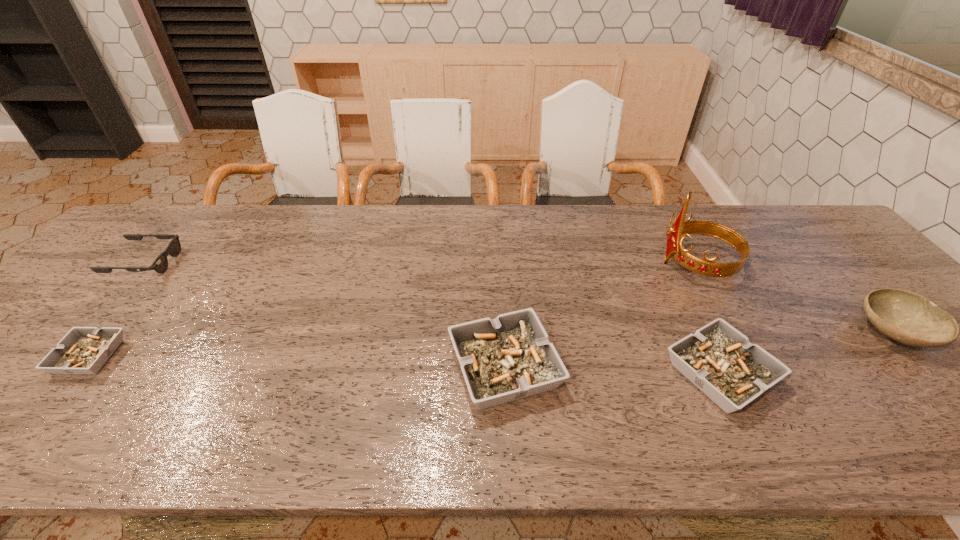
You are a GUI agent. You are given a task and a screenshot of the screen. Output one action in this format:
    pyautogui.click(x=<x>, y=<y>)
    Task: Click on the vacant area at the near edge of the desktop
    The height and width of the screenshot is (540, 960).
    Given the screenshot: What is the action you would take?
    pyautogui.click(x=377, y=406)

In the image, there is a desktop. Where is `blank space at the far left corner`? Image resolution: width=960 pixels, height=540 pixels. blank space at the far left corner is located at coordinates (156, 210).

Where is `vacant region at the far right corner of the desktop`? vacant region at the far right corner of the desktop is located at coordinates (817, 237).

Identify the location of free spot between the second ashtray from right to left and the rightmost ashtray. The image size is (960, 540). (612, 371).

The height and width of the screenshot is (540, 960). What are the coordinates of `empty space between the shortest ashtray and the rightmost ashtray` in the screenshot? It's located at (405, 366).

I want to click on vacant area between the second ashtray from left to right and the sunglasses, so click(x=324, y=315).

Image resolution: width=960 pixels, height=540 pixels. In order to click on free space between the sunglasses and the rightmost ashtray in this screenshot , I will do `click(432, 319)`.

Find the location of a particular element. Image resolution: width=960 pixels, height=540 pixels. vacant area between the shortest ashtray and the third object from left to right is located at coordinates (298, 362).

Where is `free space that is in between the second ashtray from left to right and the shortest ashtray`? free space that is in between the second ashtray from left to right and the shortest ashtray is located at coordinates (298, 362).

Identify which object is the third nearest to the rightmost object. Please provide its 2D coordinates. Your answer should be formatted as a tuple, i.e. [(x, y)], where the tuple contains the x and y coordinates of a point satisfying the conditions above.

[(508, 358)]